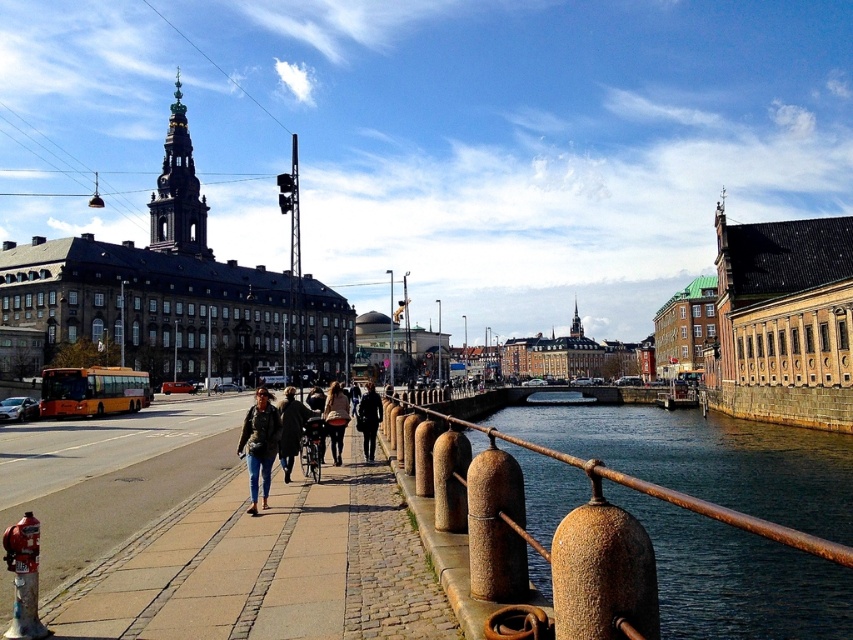
You are standing at the cobblestone pathway on the waterfront promenade. You see two points marked in the scene. Which point, point (144,628) or point (299,403), is closer to you?

Point (144,628) is closer to you than point (299,403).

You are a delivery person standing on the cobblestone sidewalk at center. You need to deliver a package to someone wearing dark blue jeans at center. Can you see the person clearly from your current position?

The cobblestone sidewalk at center is shorter than dark blue jeans at center, so the delivery person cannot see the person clearly because the sidewalk is shorter than the jeans.

You are a photographer planning to take a portrait of a person wearing both the denim jacket at center and dark blue jeans at center. Based on the scene description, which clothing item would appear closer to the camera in the photo?

The denim jacket at center is larger in size than dark blue jeans at center, so it would appear closer to the camera in the photo since larger objects in a photo typically indicate they are nearer to the camera.